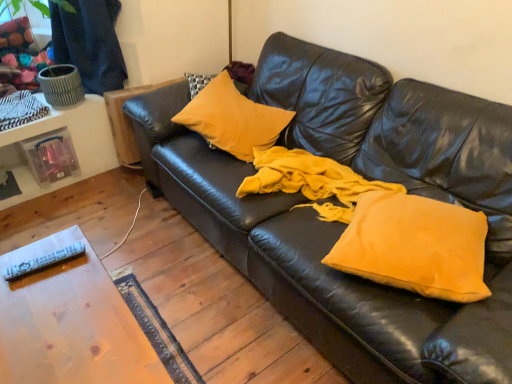
Find the location of a particular element. The image size is (512, 384). free spot above wooden table at lower left (from a real-world perspective) is located at coordinates pos(54,313).